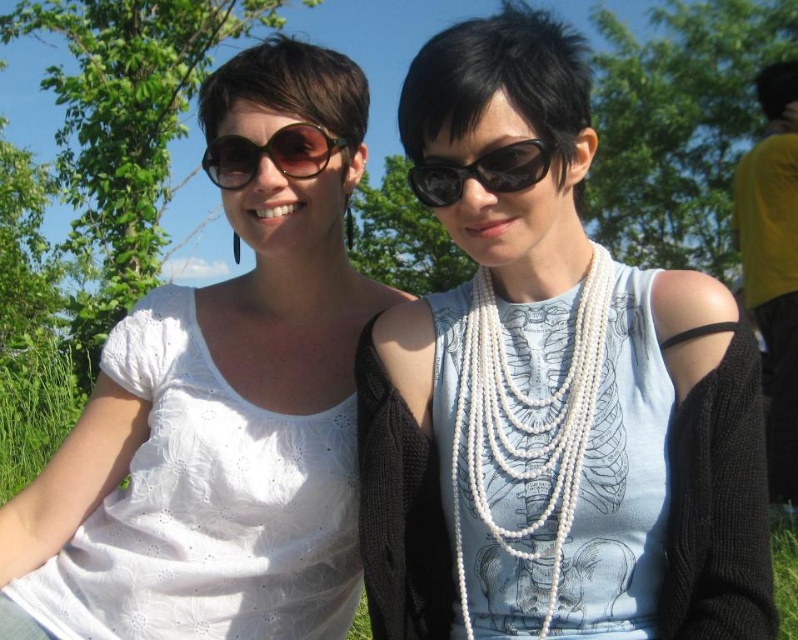
Between point (498, 371) and point (475, 172), which one is positioned in front?

Point (475, 172) is in front.

Does white pearl necklace at center appear under black plastic goggles at center?

Yes.

Where is `white pearl necklace at center`? white pearl necklace at center is located at coordinates point(524,422).

Which is below, pearl necklace at center or matte black sunglasses at upper center?

Positioned lower is pearl necklace at center.

Does point (618, 342) come farther from viewer compared to point (255, 166)?

No, (618, 342) is closer to viewer.

The image size is (798, 640). Find the location of `pearl necklace at center`. pearl necklace at center is located at coordinates (552, 396).

You are a GUI agent. You are given a task and a screenshot of the screen. Output one action in this format:
    pyautogui.click(x=<x>, y=<y>)
    Task: Click on the pearl necklace at center
    
    Given the screenshot: What is the action you would take?
    pyautogui.click(x=552, y=396)

Does matte black sunglasses at upper center appear on the left side of black plastic goggles at center?

Yes, matte black sunglasses at upper center is to the left of black plastic goggles at center.

Does matte black sunglasses at upper center appear under black plastic goggles at center?

Incorrect, matte black sunglasses at upper center is not positioned below black plastic goggles at center.

Is point (310, 122) positioned after point (552, 147)?

Yes.

Identify the location of matte black sunglasses at upper center. (269, 154).